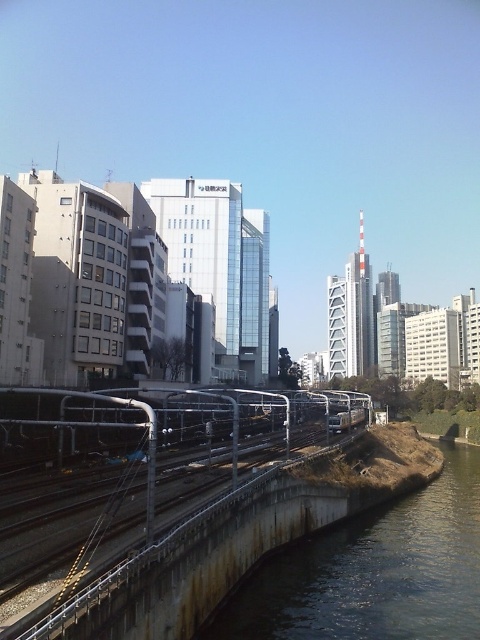
Question: Which of the following is the farthest from the observer?

Choices:
 (A) (283, 449)
 (B) (365, 413)

Answer: (B)

Question: Does brown concrete river at lower right have a greater width compared to metallic rail at center?

Choices:
 (A) yes
 (B) no

Answer: (B)

Question: Is brown concrete river at lower right wider than metallic rail at center?

Choices:
 (A) yes
 (B) no

Answer: (B)

Question: Which of the following is the closest to the observer?

Choices:
 (A) (361, 410)
 (B) (273, 428)

Answer: (B)

Question: Among these objects, which one is farthest from the camera?

Choices:
 (A) metallic rail at center
 (B) brown concrete river at lower right
 (C) silver metallic passenger train at center

Answer: (C)

Question: Does metallic rail at center appear under silver metallic passenger train at center?

Choices:
 (A) no
 (B) yes

Answer: (A)